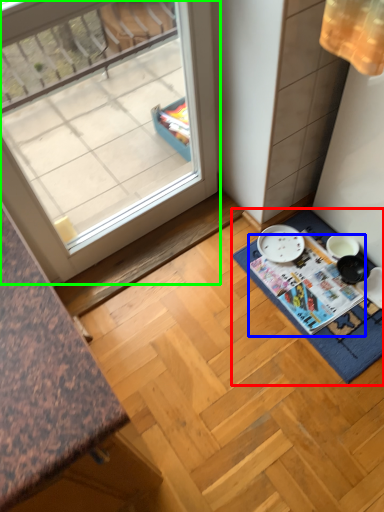
Question: Based on their relative distances, which object is farther from bath mat (highlighted by a red box)? Choose from magazine (highlighted by a blue box) and window (highlighted by a green box).

Choices:
 (A) magazine
 (B) window

Answer: (B)